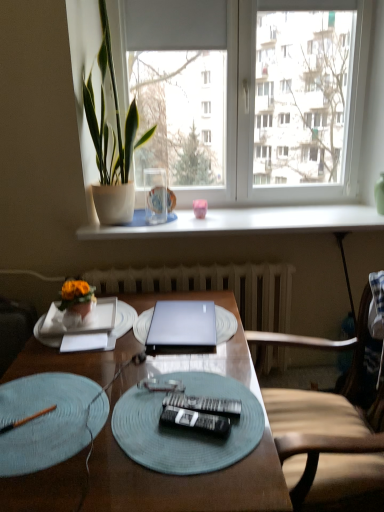
This screenshot has width=384, height=512. What are the coordinates of `blank space situated above wooden desk at center (from a real-world perspective)` in the screenshot? It's located at (140, 333).